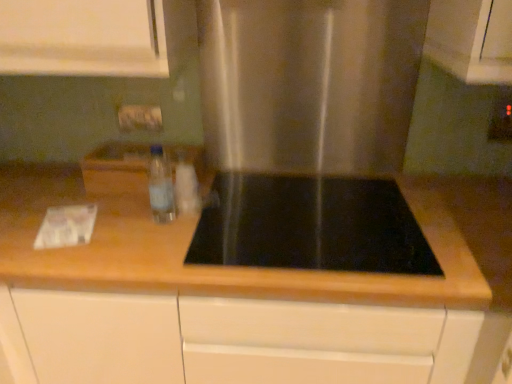
Where is `vacant space to the left of clear plastic bottle at center, the second bottle viewed from the right`? The image size is (512, 384). vacant space to the left of clear plastic bottle at center, the second bottle viewed from the right is located at coordinates (102, 215).